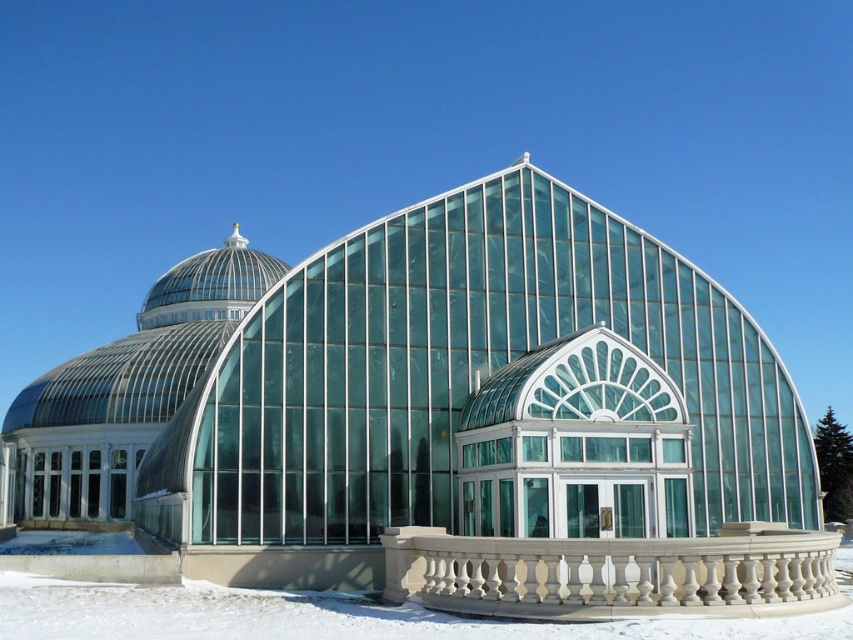
Does white stone balustrade at center lie in front of white powdery snow at lower center?

No.

Is white stone balustrade at center above white powdery snow at lower center?

Indeed, white stone balustrade at center is positioned over white powdery snow at lower center.

In order to click on white stone balustrade at center in this screenshot , I will do `click(613, 573)`.